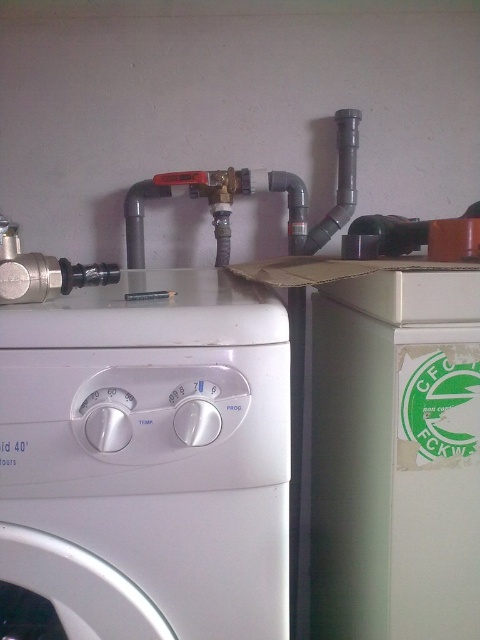
Is point (94, 589) positioned before point (289, 192)?

Yes, point (94, 589) is in front of point (289, 192).

Does white plastic washing machine at center appear over gray matte pipe at upper center?

Incorrect, white plastic washing machine at center is not positioned above gray matte pipe at upper center.

Is point (120, 378) in front of point (231, 195)?

That is True.

At what (x,y) coordinates should I click in order to perform the action: click on white plastic washing machine at center. Please return your answer as a coordinate pair (x, y). This screenshot has height=640, width=480. Looking at the image, I should click on (145, 461).